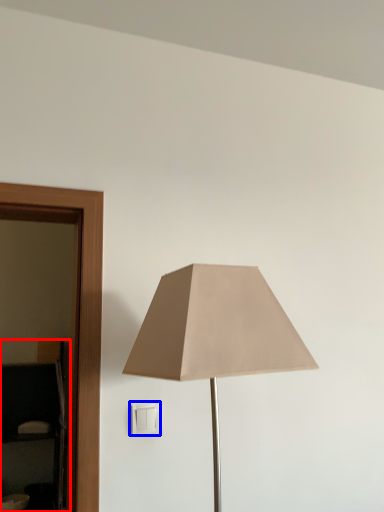
Question: Which object appears farthest to the camera in this image, dresser (highlighted by a red box) or light switch (highlighted by a blue box)?

Choices:
 (A) dresser
 (B) light switch

Answer: (A)